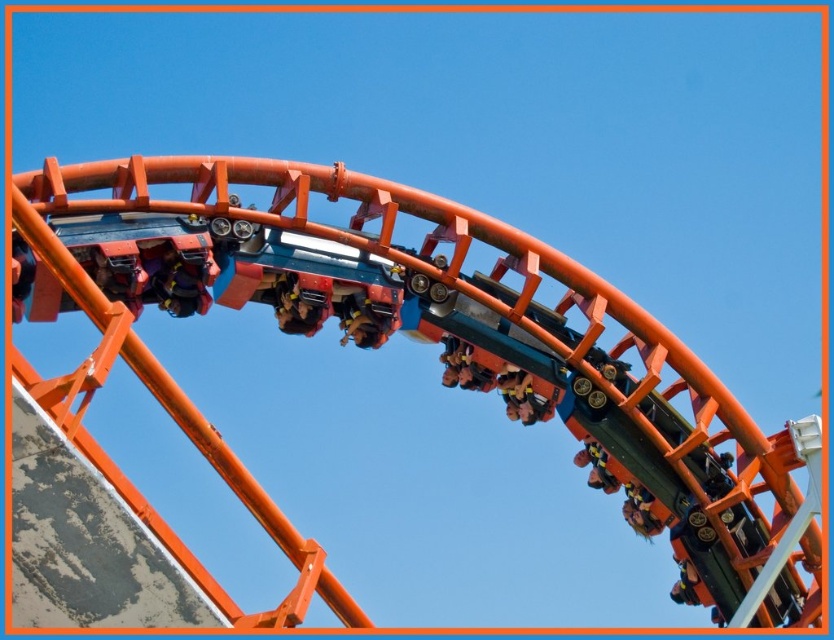
Can you confirm if metallic roller coaster at center is shorter than metallic orange roller coaster car at center?

No.

Does metallic roller coaster at center appear over metallic orange roller coaster car at center?

No.

Looking at this image, measure the distance between metallic roller coaster at center and camera.

metallic roller coaster at center and camera are 47.23 meters apart from each other.

This screenshot has width=834, height=640. I want to click on metallic roller coaster at center, so click(x=358, y=348).